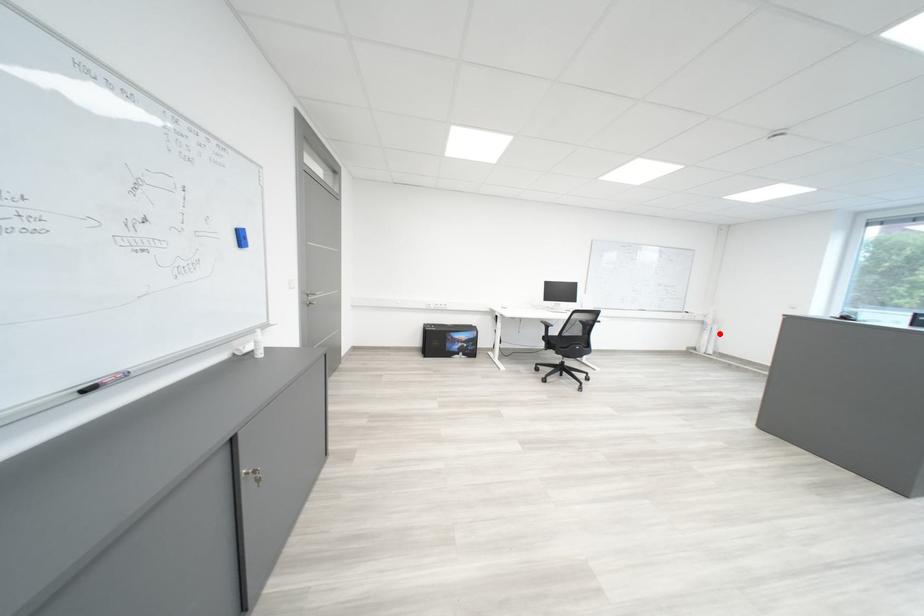
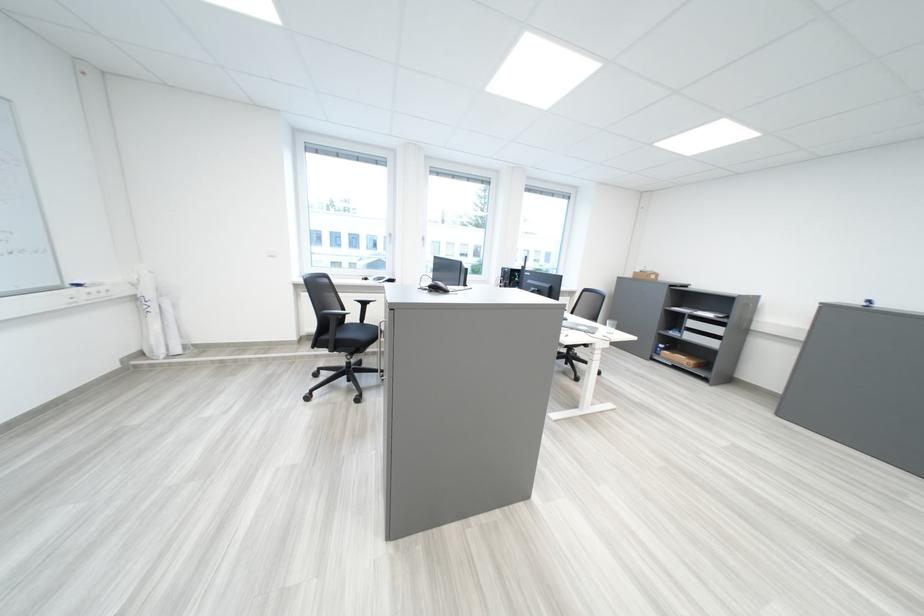
Find the pixel in the second image that matches the highlighted location in the first image.

(166, 318)